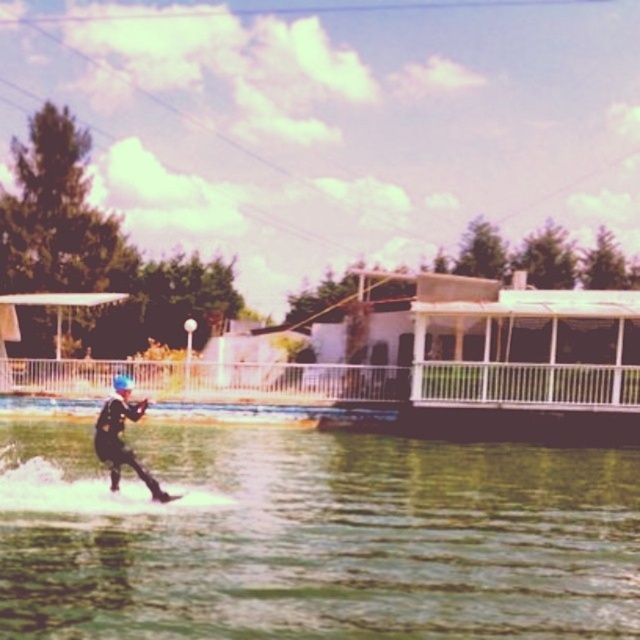
Question: Which point appears closest to the camera in this image?

Choices:
 (A) (108, 426)
 (B) (211, 428)

Answer: (A)

Question: Can you confirm if greenish water at lower center is positioned above black matte water skier at center?

Choices:
 (A) no
 (B) yes

Answer: (A)

Question: Does greenish water at lower center appear under black matte water skier at center?

Choices:
 (A) yes
 (B) no

Answer: (A)

Question: Is greenish water at lower center positioned in front of black matte water skier at center?

Choices:
 (A) no
 (B) yes

Answer: (B)